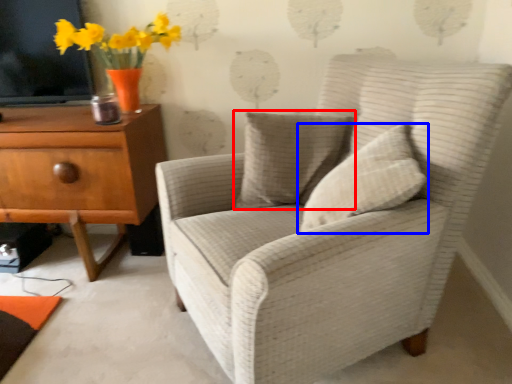
Question: Which object appears farthest to the camera in this image, pillow (highlighted by a red box) or pillow (highlighted by a blue box)?

Choices:
 (A) pillow
 (B) pillow

Answer: (A)